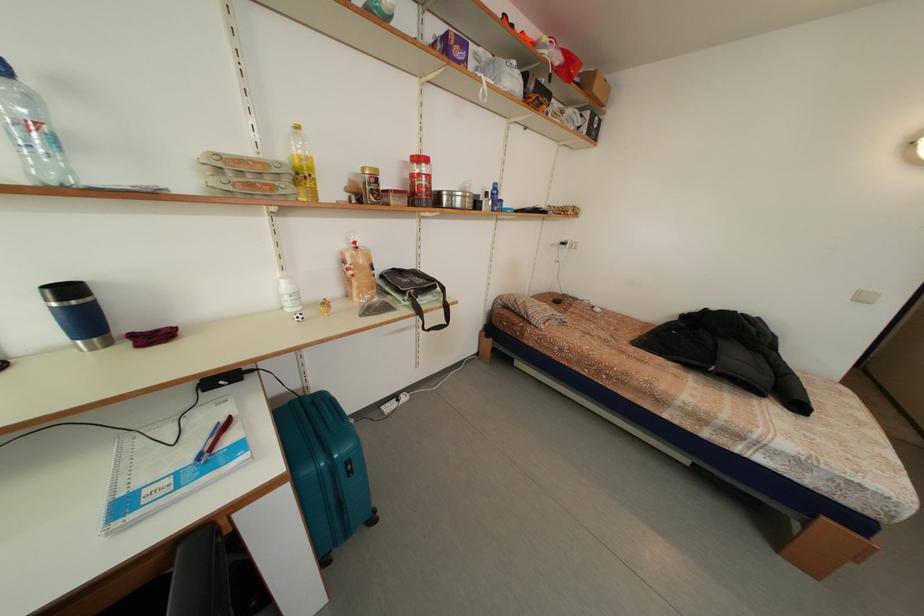
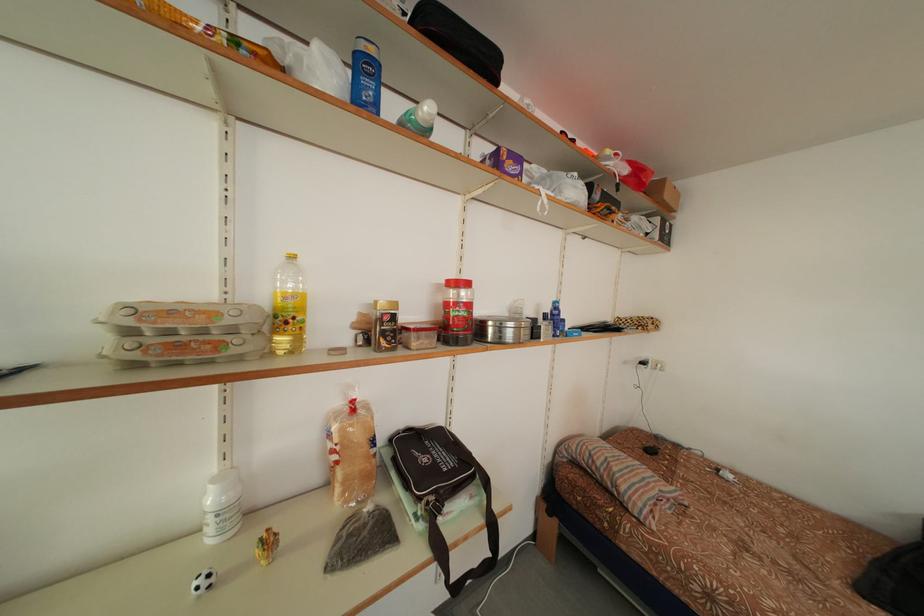
Locate, in the second image, the point that corresponds to (x=494, y=200) in the first image.

(553, 322)